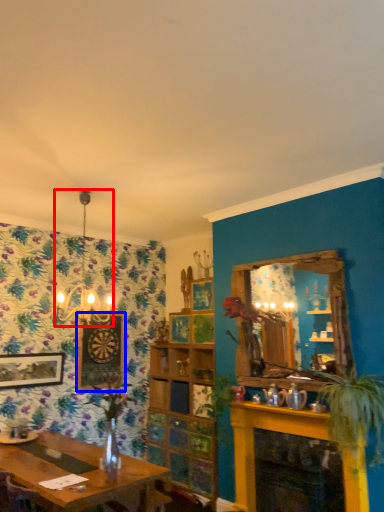
Question: Which object appears closest to the camera in this image, light fixture (highlighted by a red box) or picture frame (highlighted by a blue box)?

Choices:
 (A) light fixture
 (B) picture frame

Answer: (A)